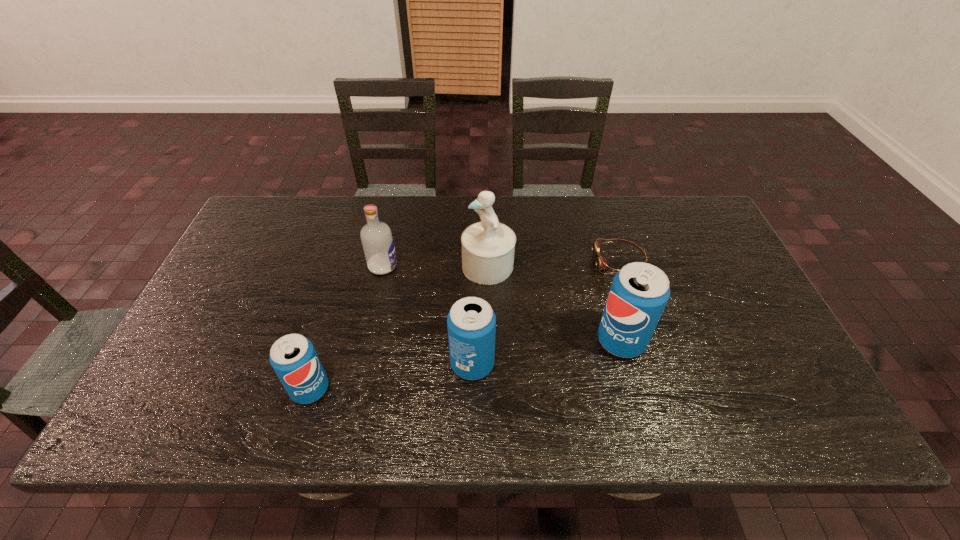
The width and height of the screenshot is (960, 540). I want to click on free space at the right edge of the desktop, so point(696,244).

You are a GUI agent. You are given a task and a screenshot of the screen. Output one action in this format:
    pyautogui.click(x=<x>, y=<y>)
    Task: Click on the free space at the far left corner of the desktop
    The width and height of the screenshot is (960, 540).
    Given the screenshot: What is the action you would take?
    pyautogui.click(x=295, y=201)

Locate an element on the screen. free space at the far right corner of the desktop is located at coordinates (662, 197).

Where is `unoccupied position between the rightmost soda can and the figurine`? This screenshot has width=960, height=540. unoccupied position between the rightmost soda can and the figurine is located at coordinates (555, 303).

Locate an element on the screen. The height and width of the screenshot is (540, 960). blank region between the second shortest soda can and the vodka is located at coordinates (428, 315).

Where is `free area in between the figurine and the goggles`? The height and width of the screenshot is (540, 960). free area in between the figurine and the goggles is located at coordinates (554, 264).

Find the location of a particular element. The image size is (960, 540). vacant region between the second soda can from left to right and the shortest object is located at coordinates (545, 313).

This screenshot has height=540, width=960. I want to click on free space between the fifth object from right to left and the second tallest soda can, so click(x=428, y=315).

The height and width of the screenshot is (540, 960). I want to click on empty location between the figurine and the fifth object from right to left, so click(436, 266).

What are the coordinates of `free space between the rightmost soda can and the figurine` in the screenshot? It's located at (555, 303).